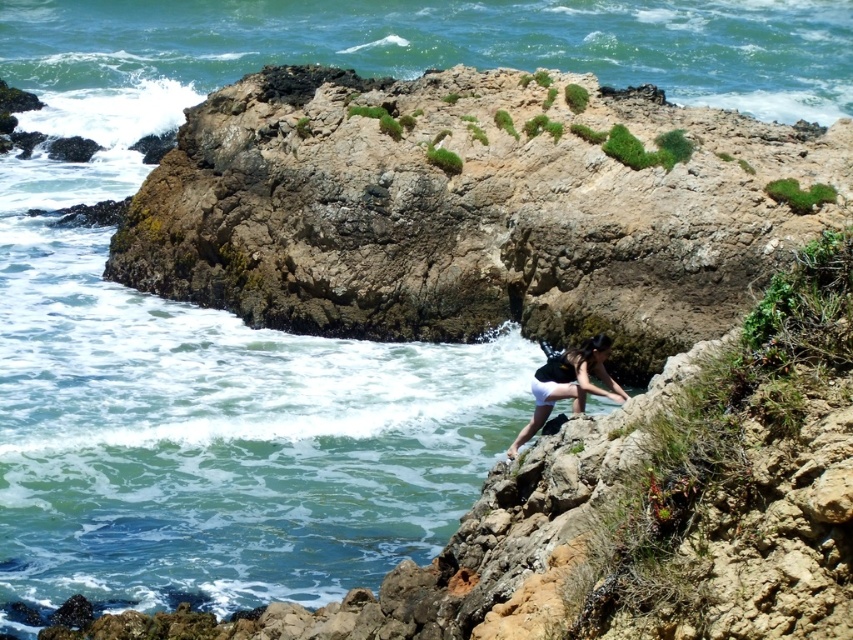
Does white matte shorts at lower center appear on the left side of white matte bikini top at lower center?

Incorrect, white matte shorts at lower center is not on the left side of white matte bikini top at lower center.

Between white matte shorts at lower center and white matte bikini top at lower center, which one has more height?

white matte bikini top at lower center is taller.

Does point (614, 387) come in front of point (550, 404)?

Yes, it is in front of point (550, 404).

Where is `white matte shorts at lower center`? This screenshot has height=640, width=853. white matte shorts at lower center is located at coordinates (579, 372).